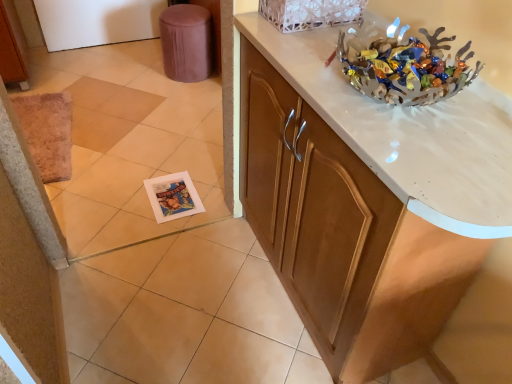
The width and height of the screenshot is (512, 384). What are the coordinates of `vacant position to the left of metallic silver bowl at upper right` in the screenshot? It's located at (304, 65).